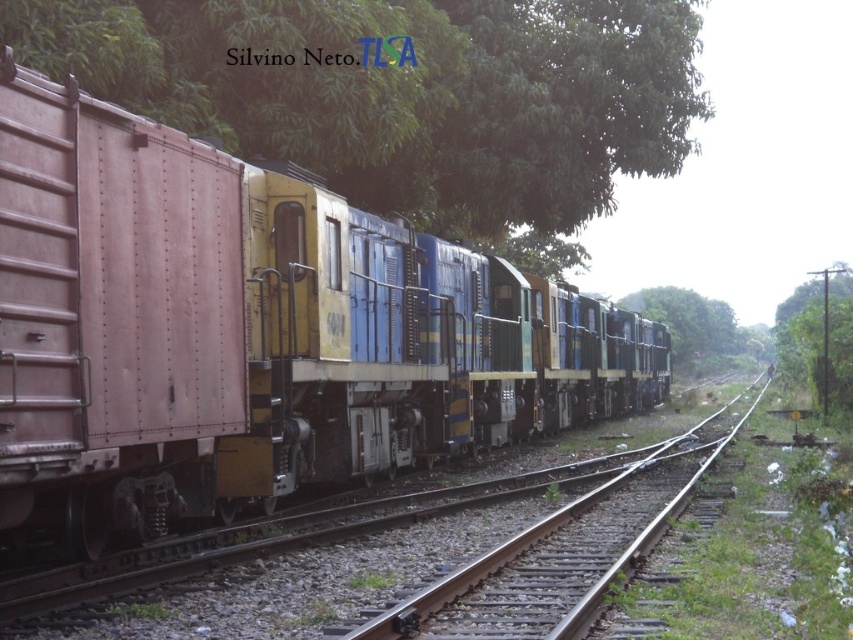
You are standing at the edge of the railway and see the green leafy tree at upper center and the green leafy tree at right. Which tree is closer to you?

The green leafy tree at upper center is closer to you because it is in front of the green leafy tree at right.

In the scene shown: You are a train engineer who needs to ensure there is enough space between the brown metal train track at center and the green leafy tree at right for your train to pass safely. The safety regulation requires at least 25 meters between the track and any obstacles. Can you proceed?

The brown metal train track at center is 30.21 meters from the green leafy tree at right. Since this distance exceeds the required 25 meters, you can proceed safely.